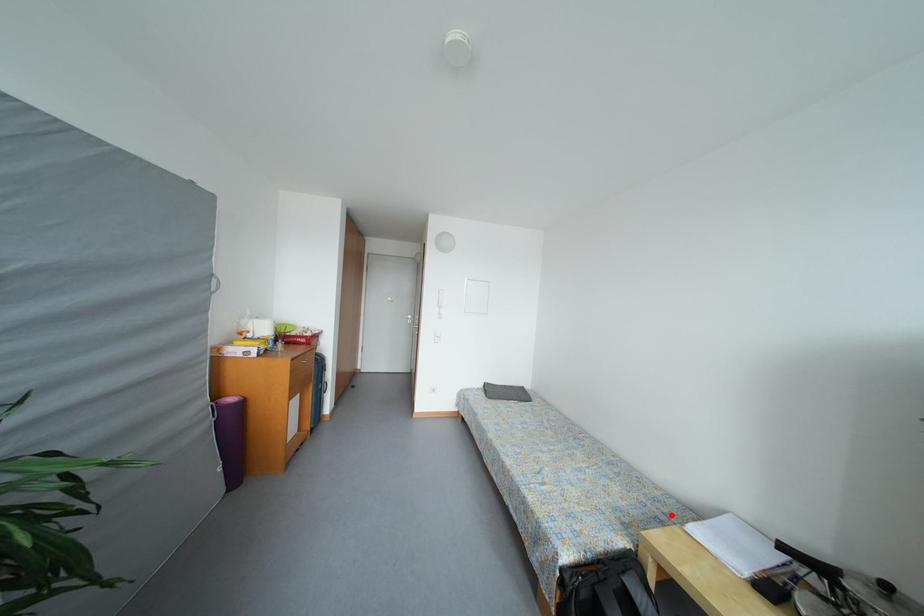
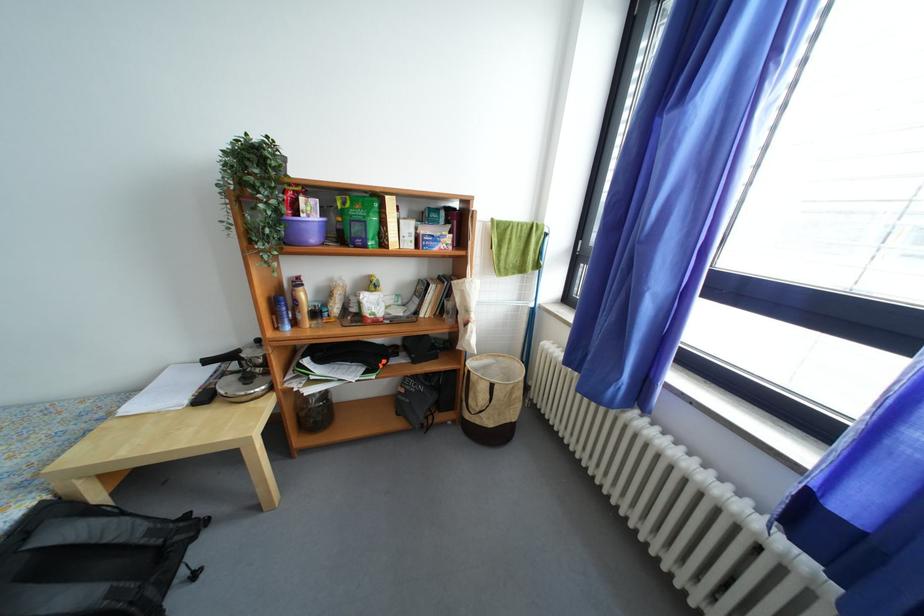
In the second image, find the point that corresponds to the highlighted location in the first image.

(106, 419)